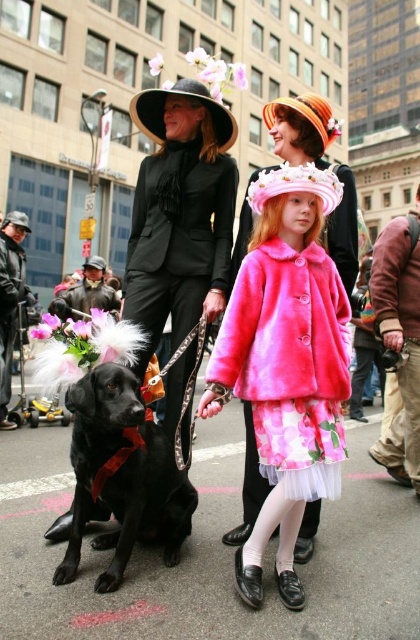
You are a photographer standing at the camera position. You want to take a closeup photo of the pink fuzzy coat at center. Can you estimate how far you need to move forward to get the subject into focus? Assume your camera requires the subject to be within 5 meters for optimal focus.

The pink fuzzy coat at center is currently 9.48 meters away from the camera. To bring it within the 5 meter optimal focus range, you would need to move forward approximately 4.48 meters closer to the subject.

From the picture: You are organizing a costume contest for pets and their owners. The judging criteria include the width of the outfits. You have two entries in front of you. The first is a pink fuzzy coat at center worn by a dog, and the second is a brown leather jacket at right worn by a person. Which entry has a wider outfit?

The brown leather jacket at right has a wider outfit since the pink fuzzy coat at center is narrower than it.